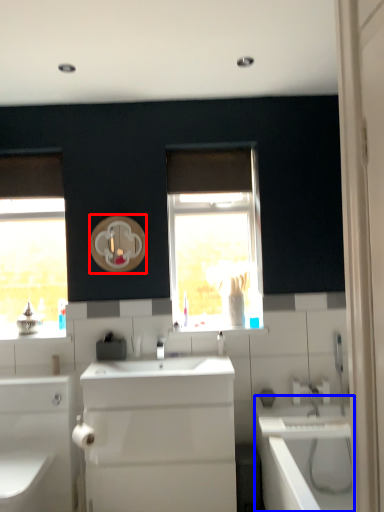
Question: Which of the following is the closest to the observer, mirror (highlighted by a red box) or bath (highlighted by a blue box)?

Choices:
 (A) mirror
 (B) bath

Answer: (B)